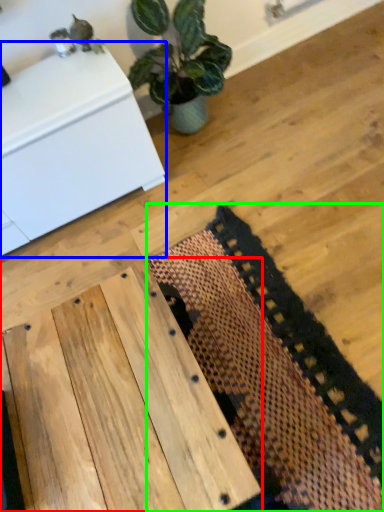
Question: Considering the real-world distances, which object is closest to table (highlighted by a red box)? furniture (highlighted by a blue box) or mat (highlighted by a green box).

Choices:
 (A) furniture
 (B) mat

Answer: (B)